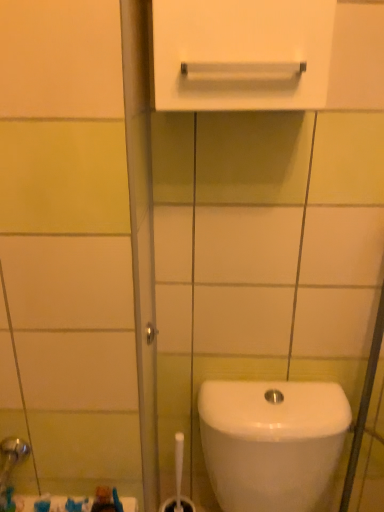
Question: Is white plastic brush at lower center not near white glossy toilet at lower right?

Choices:
 (A) yes
 (B) no

Answer: (B)

Question: Can you confirm if white plastic brush at lower center is positioned to the left of white glossy toilet at lower right?

Choices:
 (A) no
 (B) yes

Answer: (B)

Question: From a real-world perspective, is white plastic brush at lower center physically below white glossy toilet at lower right?

Choices:
 (A) no
 (B) yes

Answer: (B)

Question: Can you confirm if white plastic brush at lower center is wider than white glossy toilet at lower right?

Choices:
 (A) no
 (B) yes

Answer: (A)

Question: From a real-world perspective, is white plastic brush at lower center on top of white glossy toilet at lower right?

Choices:
 (A) yes
 (B) no

Answer: (B)

Question: Is white plastic brush at lower center closer to camera compared to white glossy toilet at lower right?

Choices:
 (A) yes
 (B) no

Answer: (B)

Question: Can you confirm if white glossy towel bar at upper center is taller than white glossy toilet at lower right?

Choices:
 (A) yes
 (B) no

Answer: (B)

Question: Is white glossy towel bar at upper center further to the viewer compared to white glossy toilet at lower right?

Choices:
 (A) yes
 (B) no

Answer: (B)

Question: Considering the relative sizes of white glossy towel bar at upper center and white glossy toilet at lower right in the image provided, is white glossy towel bar at upper center smaller than white glossy toilet at lower right?

Choices:
 (A) no
 (B) yes

Answer: (B)

Question: Is white glossy towel bar at upper center facing towards white glossy toilet at lower right?

Choices:
 (A) yes
 (B) no

Answer: (B)

Question: Can you confirm if white glossy towel bar at upper center is shorter than white glossy toilet at lower right?

Choices:
 (A) yes
 (B) no

Answer: (A)

Question: Is white glossy towel bar at upper center bigger than white glossy toilet at lower right?

Choices:
 (A) yes
 (B) no

Answer: (B)

Question: Considering the relative positions of white glossy toilet at lower right and white glossy towel bar at upper center in the image provided, is white glossy toilet at lower right to the right of white glossy towel bar at upper center from the viewer's perspective?

Choices:
 (A) yes
 (B) no

Answer: (A)